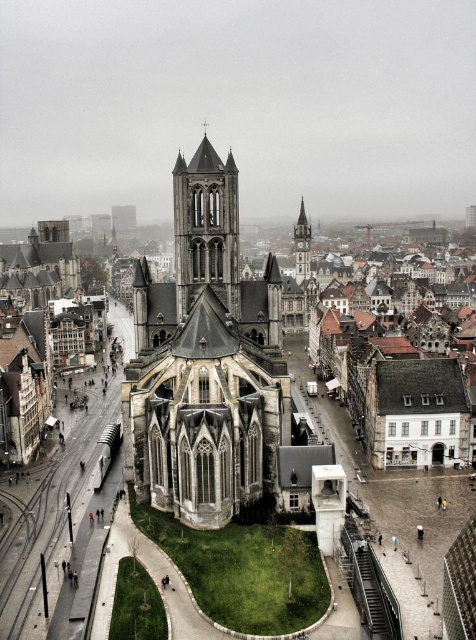
You are a tourist standing in the square and want to take a photo that includes both the smooth stone tower at center and the smooth stone clock tower at center right. The camera you have can capture a maximum angle of 60 degrees. Given their positions, will you be able to fit both towers in the frame?

The smooth stone tower at center is 149.80 meters away from the smooth stone clock tower at center right. To determine if both can fit in a 60 degree angle, we need to calculate the distance between them relative to the camera position. However, without knowing the exact distance from the camera to each tower, it is impossible to accurately determine the angle required. Therefore, the answer cannot be confirmed with the given information.

Consider the image. You are standing in the square in front of the cathedral and want to take a photo of both the smooth stone tower at center and the smooth stone clock tower at center right. Which tower should you position yourself to the left of to capture both in your shot?

You should position yourself to the left of the smooth stone clock tower at center right because the smooth stone tower at center is to the left of it, so both will be in the frame.